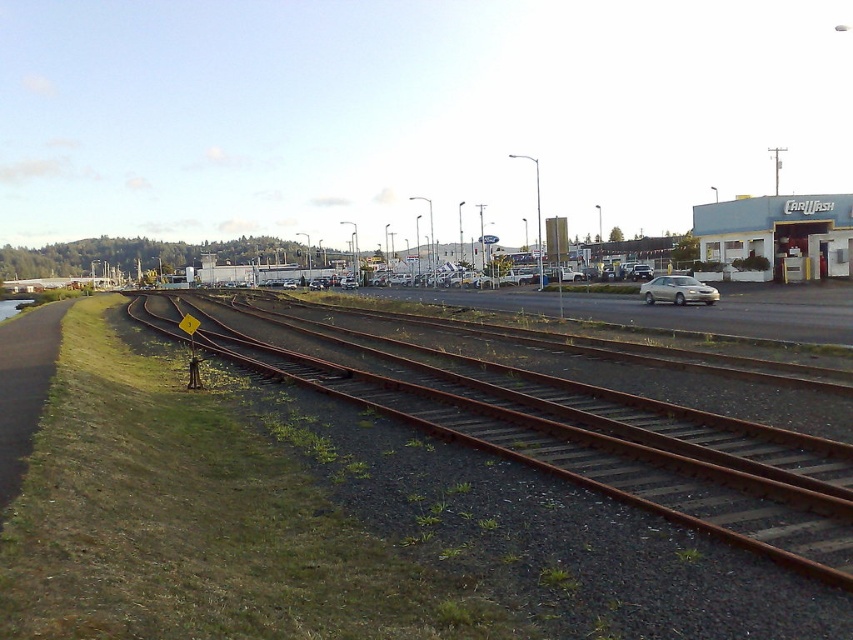
Consider the image. You are standing at the car wash and want to walk towards the railway tracks. There are two points marked on the ground ahead of you at coordinates point [202,317] and point [704,292]. Which point is closer to you as you face the railway tracks?

Point [202,317] is closer to you because it is further to the camera than point [704,292], meaning it is nearer to your current position at the car wash.

You are a railway inspector standing at the point labeled as point (x=573, y=435). According to the scene, what type of surface are you currently standing on?

The point (x=573, y=435) is on rusty metal tracks at lower left, so you are standing on rusty metal tracks.